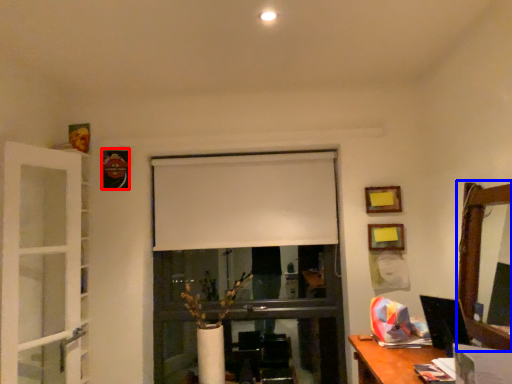
Question: Which object is further to the camera taking this photo, picture frame (highlighted by a red box) or mirror (highlighted by a blue box)?

Choices:
 (A) picture frame
 (B) mirror

Answer: (A)